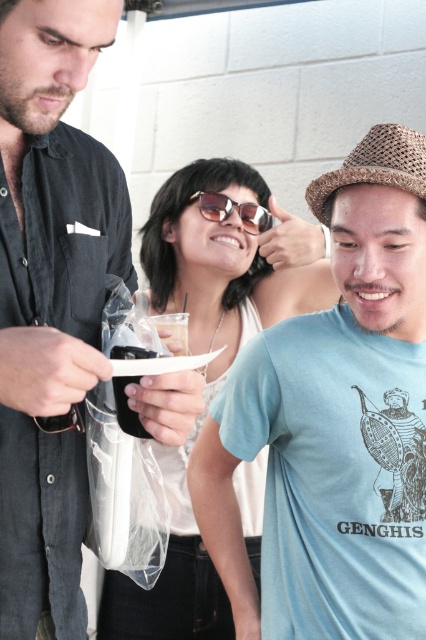
Which is more to the right, blue cotton t-shirt at center or matte black phone at center?

blue cotton t-shirt at center

Which is above, blue cotton t-shirt at center or matte black phone at center?

matte black phone at center is above.

Does point (357, 168) lie in front of point (63, 344)?

No, (357, 168) is behind (63, 344).

This screenshot has width=426, height=640. I want to click on blue cotton t-shirt at center, so (x=333, y=422).

Can you confirm if white matte sunglasses at center is positioned above sunglasses at center?

No, white matte sunglasses at center is not above sunglasses at center.

Describe the element at coordinates (207, 369) in the screenshot. I see `white matte sunglasses at center` at that location.

The width and height of the screenshot is (426, 640). In order to click on white matte sunglasses at center in this screenshot , I will do `click(207, 369)`.

Does matte black phone at center have a greater width compared to white matte sunglasses at center?

No.

Between matte black phone at center and white matte sunglasses at center, which one is positioned lower?

white matte sunglasses at center is below.

At what (x,y) coordinates should I click in order to perform the action: click on matte black phone at center. Please return your answer as a coordinate pair (x, y). Looking at the image, I should click on (51, 298).

Identify the location of matte black phone at center. This screenshot has height=640, width=426. (51, 298).